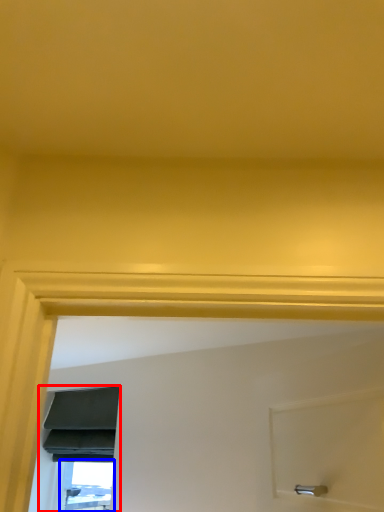
Question: Which of the following is the farthest to the observer, window (highlighted by a red box) or window (highlighted by a blue box)?

Choices:
 (A) window
 (B) window

Answer: (B)